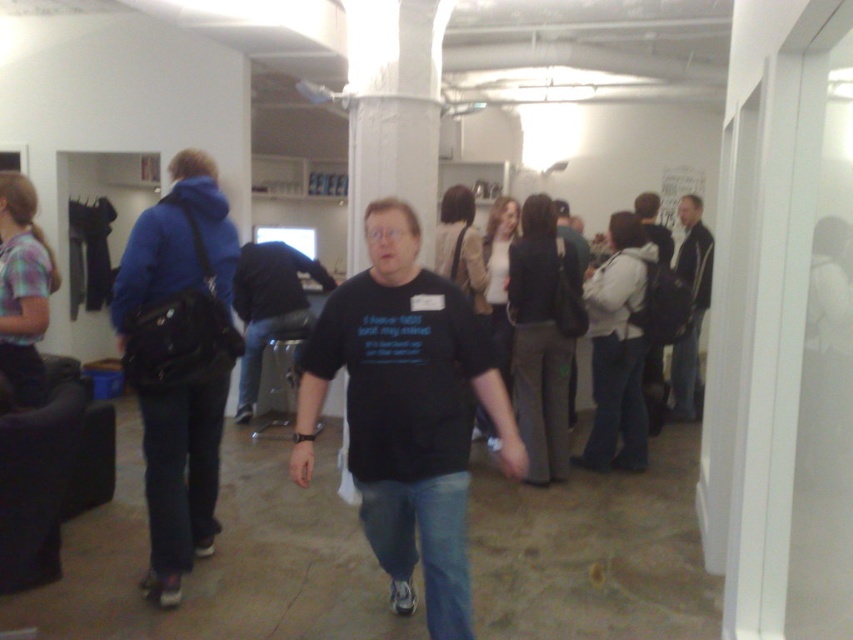
You are standing in the open space and see the black matte shirt at center and the black leather jacket at right. Which one is positioned lower in the image?

The black matte shirt at center is positioned lower than the black leather jacket at right in the image.